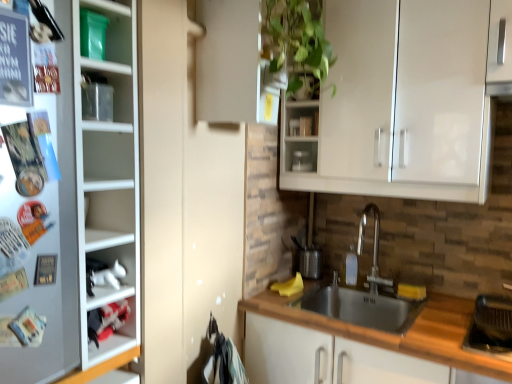
Question: Is metallic silver container at upper center looking in the opposite direction of white glossy cabinet at lower left, the 2th cabinet positioned from the bottom?

Choices:
 (A) yes
 (B) no

Answer: (B)

Question: Is metallic silver container at upper center next to white glossy cabinet at lower left, which is counted as the first cabinet, starting from the top?

Choices:
 (A) no
 (B) yes

Answer: (A)

Question: From the image's perspective, does metallic silver container at upper center appear lower than white glossy cabinet at lower left, the 2th cabinet positioned from the bottom?

Choices:
 (A) yes
 (B) no

Answer: (B)

Question: Is metallic silver container at upper center thinner than white glossy cabinet at lower left, the 2th cabinet positioned from the bottom?

Choices:
 (A) yes
 (B) no

Answer: (A)

Question: Can you confirm if metallic silver container at upper center is positioned to the left of white glossy cabinet at lower left, which is counted as the first cabinet, starting from the top?

Choices:
 (A) no
 (B) yes

Answer: (A)

Question: From a real-world perspective, is metallic silver container at upper center below white glossy cabinet at lower left, which is counted as the first cabinet, starting from the top?

Choices:
 (A) no
 (B) yes

Answer: (A)

Question: Does polished stainless steel faucet at center lie in front of stainless steel sink at lower center?

Choices:
 (A) no
 (B) yes

Answer: (A)

Question: Can you confirm if polished stainless steel faucet at center is positioned to the right of stainless steel sink at lower center?

Choices:
 (A) yes
 (B) no

Answer: (A)

Question: Is polished stainless steel faucet at center oriented towards stainless steel sink at lower center?

Choices:
 (A) no
 (B) yes

Answer: (A)

Question: Does polished stainless steel faucet at center have a greater width compared to stainless steel sink at lower center?

Choices:
 (A) yes
 (B) no

Answer: (B)

Question: Is polished stainless steel faucet at center turned away from stainless steel sink at lower center?

Choices:
 (A) no
 (B) yes

Answer: (A)

Question: Does polished stainless steel faucet at center come behind stainless steel sink at lower center?

Choices:
 (A) yes
 (B) no

Answer: (A)

Question: Does white plastic cabinet at lower left, acting as the 2th cabinet starting from the top, appear on the right side of polished stainless steel faucet at center?

Choices:
 (A) yes
 (B) no

Answer: (B)